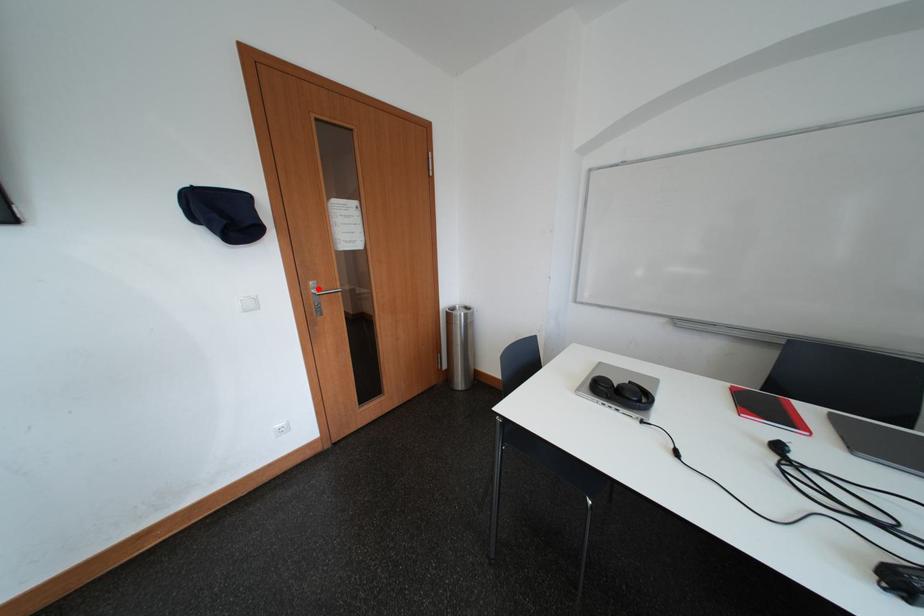
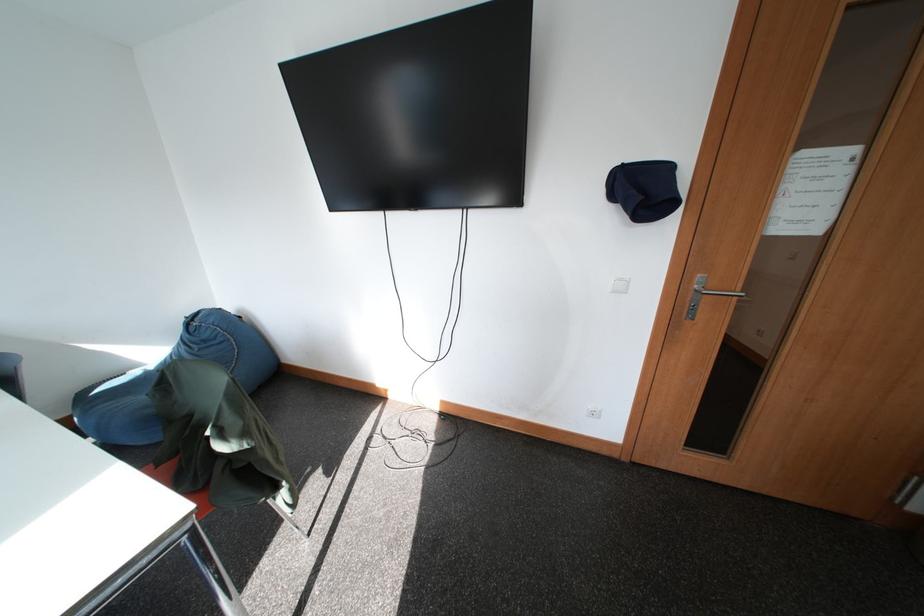
Question: I am providing you with two images of the same scene from different viewpoints. Image1 has a red point marked. In image2, the corresponding 3D location appears at what relative position? Reply with the corresponding letter.

Choices:
 (A) Closer
 (B) Farther

Answer: (B)